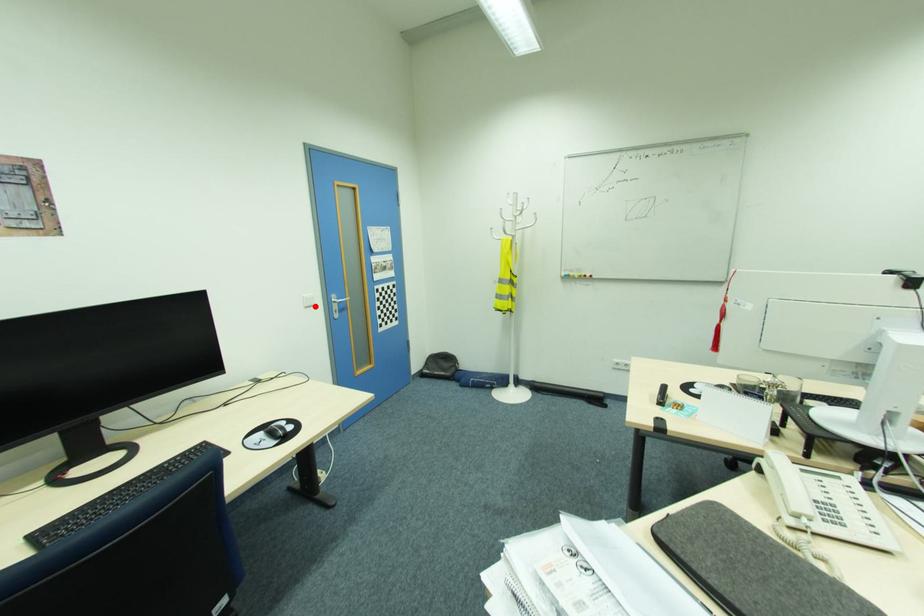
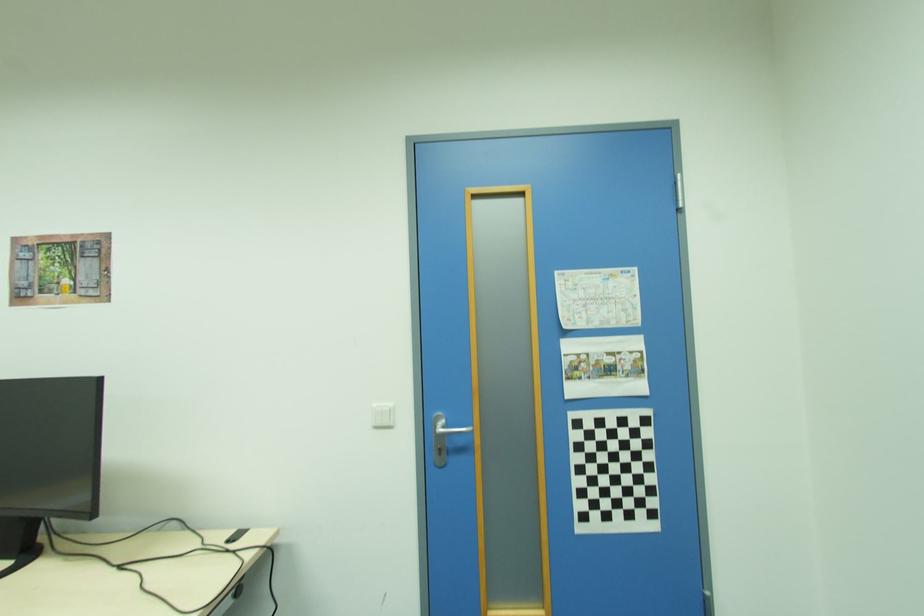
Question: A red point is marked in image1. In image2, is the corresponding 3D point closer to the camera or farther? Reply with the corresponding letter.

Choices:
 (A) The corresponding 3D point is closer.
 (B) The corresponding 3D point is farther.

Answer: (B)